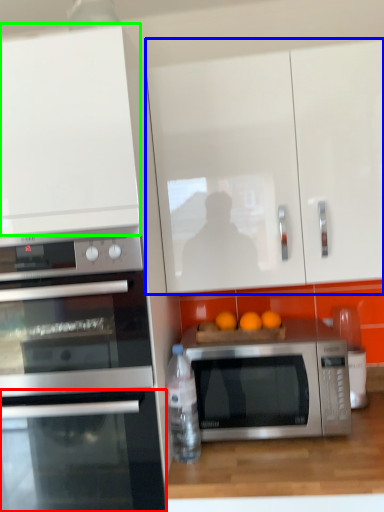
Question: Estimate the real-world distances between objects in this image. Which object is farther from oven (highlighted by a red box), cabinetry (highlighted by a blue box) or cabinetry (highlighted by a green box)?

Choices:
 (A) cabinetry
 (B) cabinetry

Answer: (A)